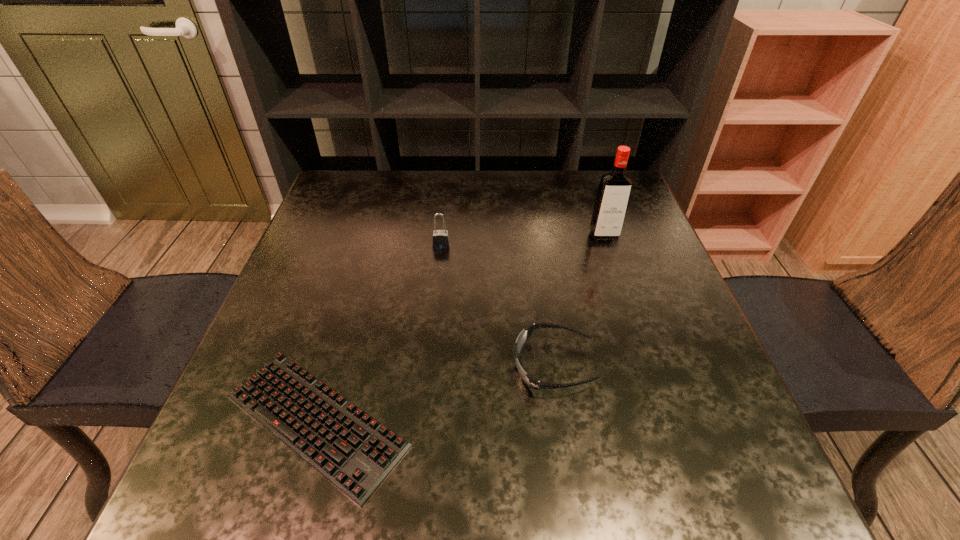
The height and width of the screenshot is (540, 960). In the image, there is a desktop. Find the location of `vacant space at the right edge`. vacant space at the right edge is located at coordinates (683, 358).

This screenshot has height=540, width=960. Identify the location of blank space at the far left corner of the desktop. (354, 177).

The image size is (960, 540). What are the coordinates of `free spot between the third tallest object and the tallest object` in the screenshot? It's located at (579, 300).

Identify the location of vacant space that's between the third shortest object and the third tallest object. (497, 306).

The width and height of the screenshot is (960, 540). I want to click on empty location between the second object from right to left and the rightmost object, so click(x=579, y=300).

Image resolution: width=960 pixels, height=540 pixels. I want to click on vacant space that is in between the farthest object and the second object from right to left, so click(x=579, y=300).

Locate an element on the screen. vacant space that's between the second shortest object and the computer keyboard is located at coordinates coord(435,393).

Identify the location of free space between the padlock and the shortest object. Image resolution: width=960 pixels, height=540 pixels. (379, 333).

Where is `free area in between the third tallest object and the padlock`? free area in between the third tallest object and the padlock is located at coordinates (497, 306).

Where is `empty space between the computer keyboard and the sunglasses`? The image size is (960, 540). empty space between the computer keyboard and the sunglasses is located at coordinates (435, 393).